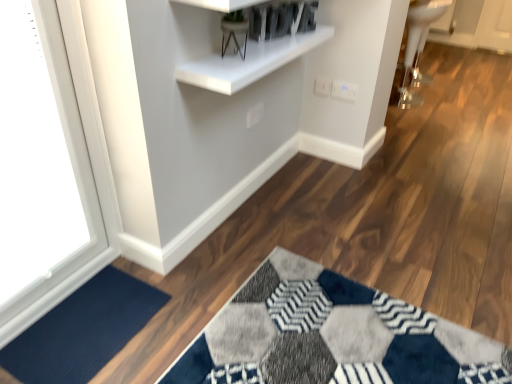
Question: Can you confirm if white plastic electric outlet at upper center, the first electric outlet from the right, is taller than white glossy sink at upper right?

Choices:
 (A) yes
 (B) no

Answer: (B)

Question: From the image's perspective, is white plastic electric outlet at upper center, the 2th electric outlet when ordered from left to right, under white glossy sink at upper right?

Choices:
 (A) yes
 (B) no

Answer: (A)

Question: Is white plastic electric outlet at upper center, the first electric outlet from the right, positioned beyond the bounds of white glossy sink at upper right?

Choices:
 (A) yes
 (B) no

Answer: (A)

Question: Considering the relative positions of white plastic electric outlet at upper center, the first electric outlet from the right, and white glossy sink at upper right in the image provided, is white plastic electric outlet at upper center, the first electric outlet from the right, to the right of white glossy sink at upper right from the viewer's perspective?

Choices:
 (A) yes
 (B) no

Answer: (B)

Question: From a real-world perspective, is white plastic electric outlet at upper center, the 2th electric outlet when ordered from left to right, located higher than white glossy sink at upper right?

Choices:
 (A) no
 (B) yes

Answer: (B)

Question: Considering the positions of white plastic electric outlet at upper right, which is the 1th electric outlet in left-to-right order, and navy blue carpet at lower left in the image, is white plastic electric outlet at upper right, which is the 1th electric outlet in left-to-right order, bigger or smaller than navy blue carpet at lower left?

Choices:
 (A) small
 (B) big

Answer: (A)

Question: Is white plastic electric outlet at upper right, the second electric outlet in the right-to-left sequence, in front of or behind navy blue carpet at lower left in the image?

Choices:
 (A) behind
 (B) front

Answer: (A)

Question: Is white plastic electric outlet at upper right, the second electric outlet in the right-to-left sequence, wider or thinner than navy blue carpet at lower left?

Choices:
 (A) wide
 (B) thin

Answer: (B)

Question: From their relative heights in the image, would you say white plastic electric outlet at upper right, the second electric outlet in the right-to-left sequence, is taller or shorter than navy blue carpet at lower left?

Choices:
 (A) short
 (B) tall

Answer: (B)

Question: In terms of width, does white glossy shelf at upper center look wider or thinner when compared to white glossy window at upper left?

Choices:
 (A) wide
 (B) thin

Answer: (A)

Question: From their relative heights in the image, would you say white glossy shelf at upper center is taller or shorter than white glossy window at upper left?

Choices:
 (A) short
 (B) tall

Answer: (A)

Question: From the image's perspective, is white glossy shelf at upper center above or below white glossy window at upper left?

Choices:
 (A) below
 (B) above

Answer: (B)

Question: Based on their positions, is white glossy shelf at upper center located to the left or right of white glossy window at upper left?

Choices:
 (A) right
 (B) left

Answer: (A)

Question: Do you think white plastic electric outlet at upper right, the second electric outlet in the right-to-left sequence, is within white glossy shelf at upper center, or outside of it?

Choices:
 (A) outside
 (B) inside

Answer: (A)

Question: Considering the positions of white plastic electric outlet at upper right, the second electric outlet in the right-to-left sequence, and white glossy shelf at upper center in the image, is white plastic electric outlet at upper right, the second electric outlet in the right-to-left sequence, wider or thinner than white glossy shelf at upper center?

Choices:
 (A) thin
 (B) wide

Answer: (A)